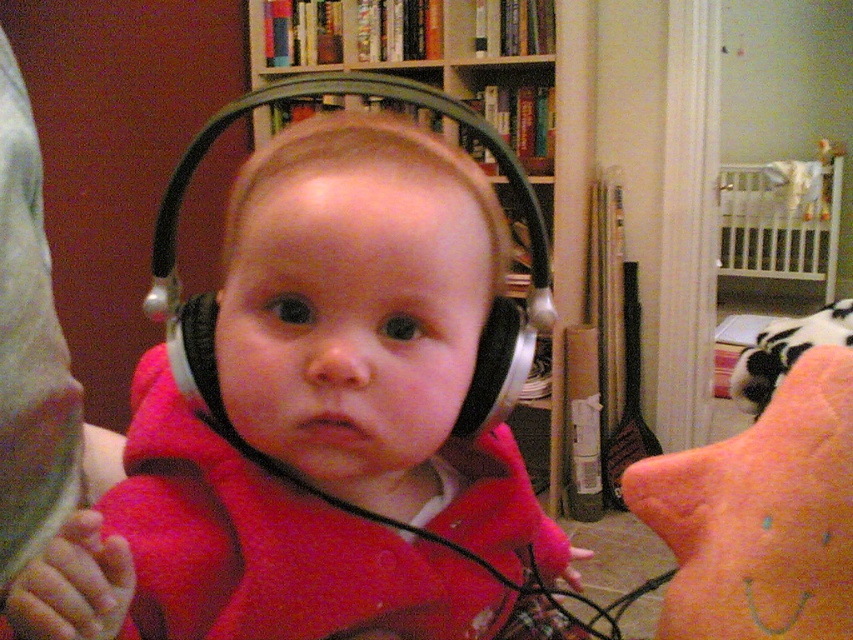
Does matte black headphones at center have a greater height compared to wooden bookshelf at upper center?

No, matte black headphones at center is not taller than wooden bookshelf at upper center.

Between point (393, 168) and point (502, 10), which one is positioned in front?

Positioned in front is point (393, 168).

Which is behind, point (474, 220) or point (575, 164)?

Point (575, 164)

The height and width of the screenshot is (640, 853). Identify the location of matte black headphones at center. (374, 330).